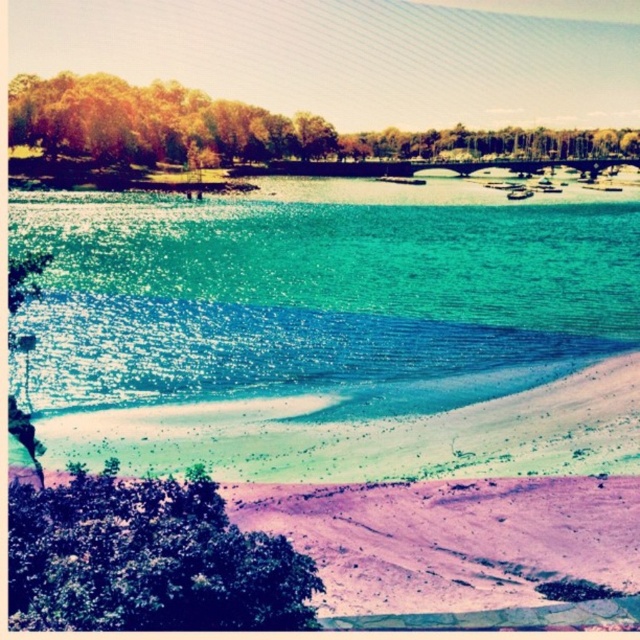
Wait, the objects list has two entries that are almost the same. The first is plural, the second singular. Maybe that was a mistake. Let me check the original input again. The user provided the Objects as green leafy trees at upper center and green leafy tree at upper center. So they are two separate objects. The description says the plural one is larger than the singular one. Hmm, but that seems odd. Maybe it was a typo, but I have to follow the input as given. So the question must include both objects as

The green leafy trees at upper center are larger in size compared to the green leafy tree at upper center.

Based on the photo, in the surreal landscape with the pinkish purple sand and gradient water, there is a point marked at coordinates (x=321, y=298). What does this point indicate?

The point at coordinates (x=321, y=298) marks the location of translucent teal water at center.